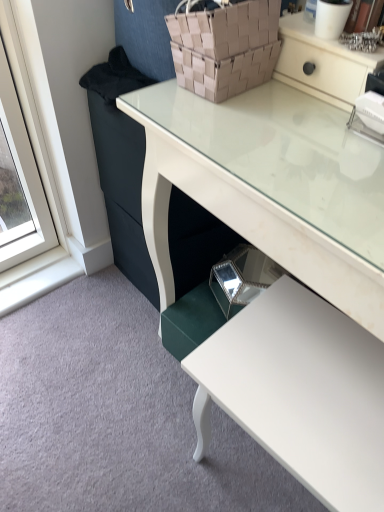
Describe the element at coordinates (300, 392) in the screenshot. I see `white glossy table at lower right` at that location.

Locate an element on the screen. white glossy desk at center is located at coordinates (270, 186).

I want to click on white glossy table at lower right, so (x=300, y=392).

From a real-world perspective, is brown woven basket at upper center located higher than white glossy desk at center?

Yes, from a real-world perspective, brown woven basket at upper center is above white glossy desk at center.

Does brown woven basket at upper center appear on the right side of white glossy desk at center?

No, brown woven basket at upper center is not to the right of white glossy desk at center.

Which point is more forward, (x=244, y=45) or (x=288, y=249)?

Positioned in front is point (x=288, y=249).

The width and height of the screenshot is (384, 512). I want to click on desk that is on the right side of brown woven basket at upper center, so click(x=270, y=186).

Does brown woven basket at upper center lie behind white glossy table at lower right?

Yes, brown woven basket at upper center is behind white glossy table at lower right.

Does brown woven basket at upper center have a larger size compared to white glossy table at lower right?

Incorrect, brown woven basket at upper center is not larger than white glossy table at lower right.

Locate an element on the screen. The height and width of the screenshot is (512, 384). table below the brown woven basket at upper center (from the image's perspective) is located at coordinates (300, 392).

Can you confirm if white glossy desk at center is thinner than white glossy table at lower right?

In fact, white glossy desk at center might be wider than white glossy table at lower right.

Is white glossy desk at center with white glossy table at lower right?

white glossy desk at center and white glossy table at lower right are not in contact.

Is white glossy desk at center inside the boundaries of white glossy table at lower right, or outside?

white glossy desk at center exists outside the volume of white glossy table at lower right.

From a real-world perspective, who is located lower, white glossy desk at center or white glossy table at lower right?

white glossy table at lower right.

In terms of width, does white glossy table at lower right look wider or thinner when compared to brown woven basket at upper center?

In the image, white glossy table at lower right appears to be wider than brown woven basket at upper center.

Based on their sizes in the image, would you say white glossy table at lower right is bigger or smaller than brown woven basket at upper center?

white glossy table at lower right is bigger than brown woven basket at upper center.

Who is taller, white glossy table at lower right or brown woven basket at upper center?

white glossy table at lower right is taller.

Between white glossy desk at center and brown woven basket at upper center, which one has smaller width?

brown woven basket at upper center is thinner.

Which is more to the left, white glossy desk at center or brown woven basket at upper center?

From the viewer's perspective, brown woven basket at upper center appears more on the left side.

Is white glossy desk at center positioned beyond the bounds of brown woven basket at upper center?

Indeed, white glossy desk at center is completely outside brown woven basket at upper center.

From their relative heights in the image, would you say white glossy table at lower right is taller or shorter than white glossy desk at center?

white glossy table at lower right is shorter than white glossy desk at center.

Is white glossy table at lower right behind white glossy desk at center?

That is True.

From a real-world perspective, who is located lower, white glossy table at lower right or white glossy desk at center?

white glossy table at lower right, from a real-world perspective.

In terms of size, does white glossy table at lower right appear bigger or smaller than white glossy desk at center?

Clearly, white glossy table at lower right is smaller in size than white glossy desk at center.

Find the location of a particular element. The height and width of the screenshot is (512, 384). basket above the white glossy desk at center (from a real-world perspective) is located at coordinates 225,48.

Image resolution: width=384 pixels, height=512 pixels. I want to click on table below the brown woven basket at upper center (from the image's perspective), so click(x=300, y=392).

Considering their positions, is white glossy table at lower right positioned closer to white glossy desk at center than brown woven basket at upper center?

brown woven basket at upper center.

Which object lies nearer to the anchor point white glossy table at lower right, brown woven basket at upper center or white glossy desk at center?

The object closer to white glossy table at lower right is white glossy desk at center.

When comparing their distances from brown woven basket at upper center, does white glossy table at lower right or white glossy desk at center seem further?

The object further to brown woven basket at upper center is white glossy table at lower right.

Which object lies further to the anchor point white glossy table at lower right, white glossy desk at center or brown woven basket at upper center?

brown woven basket at upper center lies further to white glossy table at lower right than the other object.

Estimate the real-world distances between objects in this image. Which object is further from brown woven basket at upper center, white glossy desk at center or white glossy table at lower right?

white glossy table at lower right is positioned further to the anchor brown woven basket at upper center.

From the picture: When comparing their distances from white glossy desk at center, does brown woven basket at upper center or white glossy table at lower right seem further?

white glossy table at lower right is positioned further to the anchor white glossy desk at center.

Locate an element on the screen. desk between brown woven basket at upper center and white glossy table at lower right in the vertical direction is located at coordinates (270, 186).